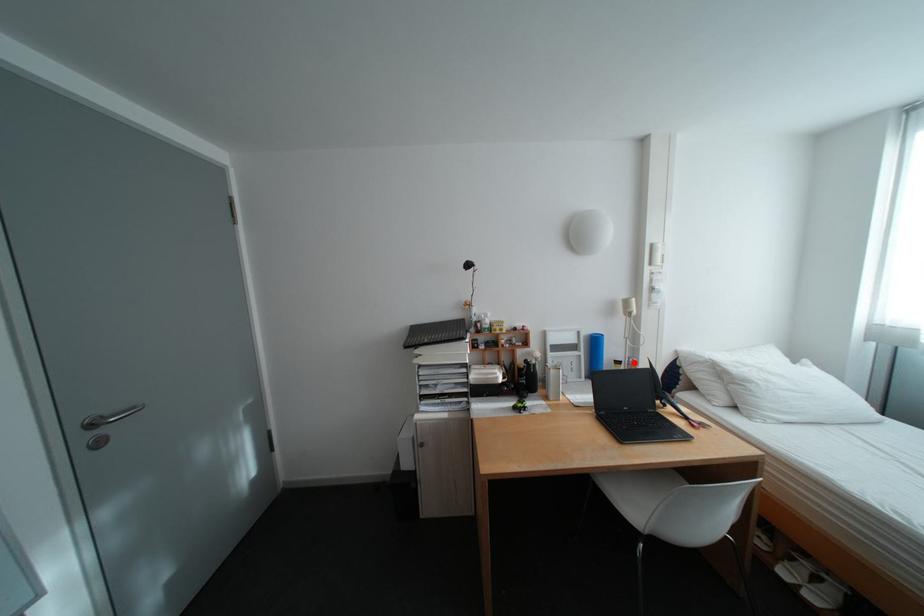
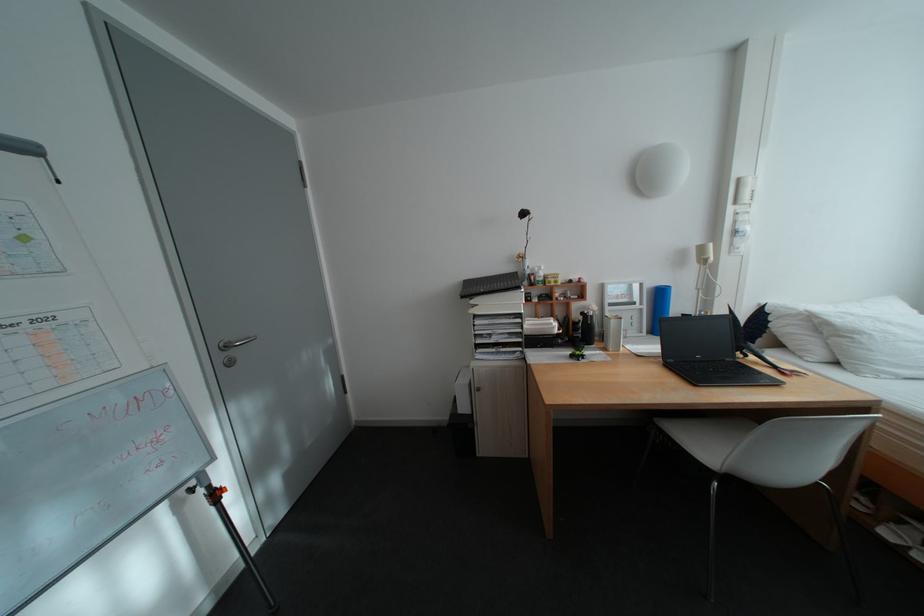
Locate, in the second image, the point that corresponds to the highlighted location in the first image.

(703, 315)